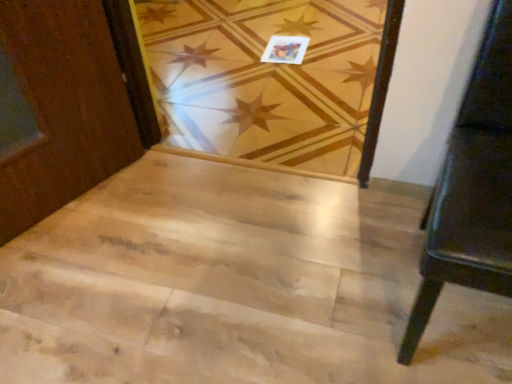
The image size is (512, 384). I want to click on vacant space that is to the left of black leather bench at right, so click(307, 279).